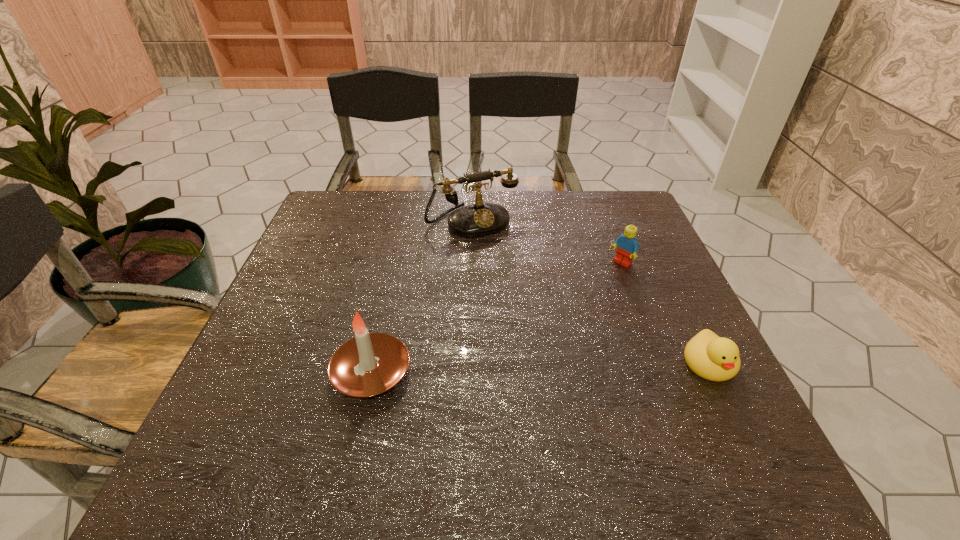
The height and width of the screenshot is (540, 960). I want to click on free spot on the desktop that is between the candle and the rightmost object and is positioned on the face of the third tallest object, so click(500, 369).

Image resolution: width=960 pixels, height=540 pixels. What are the coordinates of `free space on the desktop that is between the candle and the rightmost object and is positioned on the dial of the telephone` in the screenshot? It's located at (565, 367).